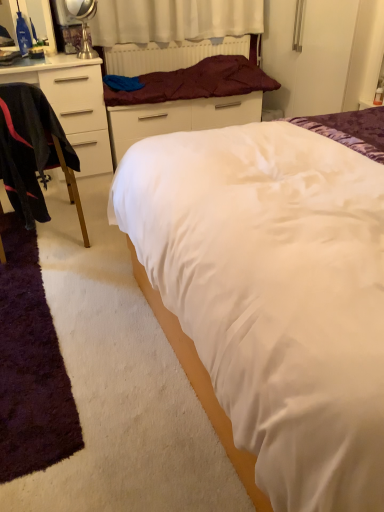
Describe the element at coordinates (188, 91) in the screenshot. I see `white glossy bed frame at upper center` at that location.

This screenshot has height=512, width=384. Describe the element at coordinates (260, 311) in the screenshot. I see `white satin bed at center` at that location.

In order to face white matte cabinet at left, should I rotate leftwards or rightwards?

Turn left by 18.884 degrees to look at white matte cabinet at left.

Where is `maroon fabric radiator at upper center`? Image resolution: width=384 pixels, height=512 pixels. maroon fabric radiator at upper center is located at coordinates (170, 55).

Image resolution: width=384 pixels, height=512 pixels. Describe the element at coordinates (30, 365) in the screenshot. I see `purple shaggy rug at lower left` at that location.

At what (x,y) coordinates should I click in order to perform the action: click on white glossy bed frame at upper center. Please return your answer as a coordinate pair (x, y). Looking at the image, I should click on [188, 91].

Is white glossy bed frame at upper center outside of maroon fabric radiator at upper center?

white glossy bed frame at upper center is positioned outside maroon fabric radiator at upper center.

Where is `radiator above the white glossy bed frame at upper center (from the image's perspective)`? This screenshot has width=384, height=512. radiator above the white glossy bed frame at upper center (from the image's perspective) is located at coordinates (170, 55).

Based on their positions, is white glossy bed frame at upper center located to the left or right of maroon fabric radiator at upper center?

Based on their positions, white glossy bed frame at upper center is located to the left of maroon fabric radiator at upper center.

How many degrees apart are the facing directions of white glossy bed frame at upper center and maroon fabric radiator at upper center?

0.422 degrees separate the facing orientations of white glossy bed frame at upper center and maroon fabric radiator at upper center.

Relative to white glossy bed frame at upper center, is white matte cabinet at left in front or behind?

Clearly, white matte cabinet at left is in front of white glossy bed frame at upper center.

Is white glossy bed frame at upper center completely or partially inside white matte cabinet at left?

No, white glossy bed frame at upper center is located outside of white matte cabinet at left.

Does white matte cabinet at left have a smaller size compared to white glossy bed frame at upper center?

No, white matte cabinet at left is not smaller than white glossy bed frame at upper center.

Is white matte cabinet at left at the right side of white glossy bed frame at upper center?

No.

Is maroon fabric radiator at upper center far away from burgundy fabric blanket at upper center?

maroon fabric radiator at upper center is near burgundy fabric blanket at upper center, not far away.

Is maroon fabric radiator at upper center behind burgundy fabric blanket at upper center?

Yes, maroon fabric radiator at upper center is behind burgundy fabric blanket at upper center.

Considering the relative sizes of maroon fabric radiator at upper center and burgundy fabric blanket at upper center in the image provided, is maroon fabric radiator at upper center bigger than burgundy fabric blanket at upper center?

No, maroon fabric radiator at upper center is not bigger than burgundy fabric blanket at upper center.

From the image's perspective, is purple shaggy rug at lower left beneath maroon fabric radiator at upper center?

Yes, from the image's perspective, purple shaggy rug at lower left is below maroon fabric radiator at upper center.

Is purple shaggy rug at lower left taller than maroon fabric radiator at upper center?

Incorrect, the height of purple shaggy rug at lower left is not larger of that of maroon fabric radiator at upper center.

Considering the points (138, 112) and (26, 74), which point is behind, point (138, 112) or point (26, 74)?

The point (138, 112) is farther.

Is white glossy bed frame at upper center not close to white matte cabinet at left?

No.

Does white glossy bed frame at upper center turn towards white matte cabinet at left?

No, white glossy bed frame at upper center is not aimed at white matte cabinet at left.

From the image's perspective, is white glossy bed frame at upper center located above white matte cabinet at left?

Yes, from the image's perspective, white glossy bed frame at upper center is above white matte cabinet at left.

Does point (181, 82) come in front of point (122, 65)?

Yes, it is in front of point (122, 65).

You are a GUI agent. You are given a task and a screenshot of the screen. Output one action in this format:
    pyautogui.click(x=<x>, y=<y>)
    Task: Click on the blanket on the right of maroon fabric radiator at upper center
    
    Given the screenshot: What is the action you would take?
    tap(196, 82)

Based on the photo, based on their positions, is burgundy fabric blanket at upper center located to the left or right of maroon fabric radiator at upper center?

Clearly, burgundy fabric blanket at upper center is on the right of maroon fabric radiator at upper center in the image.

From the image's perspective, between black fabric chair at left and burgundy fabric blanket at upper center, who is located below?

From the image's view, black fabric chair at left is below.

Which object is positioned more to the left, black fabric chair at left or burgundy fabric blanket at upper center?

black fabric chair at left.

Does point (41, 159) appear closer or farther from the camera than point (253, 77)?

Point (41, 159) is positioned closer to the camera compared to point (253, 77).

I want to click on bed frame in front of the maroon fabric radiator at upper center, so click(x=188, y=91).

Identify the location of cabinetry above the white glossy bed frame at upper center (from a real-world perspective). click(x=73, y=105).

Consider the image. Based on their spatial positions, is burgundy fabric blanket at upper center or white satin bed at center further from black fabric chair at left?

burgundy fabric blanket at upper center is positioned further to the anchor black fabric chair at left.

When comparing their distances from white satin bed at center, does purple shaggy rug at lower left or maroon fabric radiator at upper center seem closer?

Among the two, purple shaggy rug at lower left is located nearer to white satin bed at center.

From the picture: When comparing their distances from black fabric chair at left, does maroon fabric radiator at upper center or white satin bed at center seem further?

maroon fabric radiator at upper center is positioned further to the anchor black fabric chair at left.

Based on their spatial positions, is white satin bed at center or white glossy bed frame at upper center further from white matte cabinet at left?

white satin bed at center is further to white matte cabinet at left.

When comparing their distances from black fabric chair at left, does white satin bed at center or burgundy fabric blanket at upper center seem closer?

white satin bed at center is positioned closer to the anchor black fabric chair at left.

Looking at the image, which one is located further to white glossy bed frame at upper center, maroon fabric radiator at upper center or burgundy fabric blanket at upper center?

maroon fabric radiator at upper center lies further to white glossy bed frame at upper center than the other object.

Estimate the real-world distances between objects in this image. Which object is closer to white satin bed at center, purple shaggy rug at lower left or white matte cabinet at left?

purple shaggy rug at lower left.

When comparing their distances from purple shaggy rug at lower left, does white satin bed at center or white glossy bed frame at upper center seem closer?

Based on the image, white satin bed at center appears to be nearer to purple shaggy rug at lower left.

You are a GUI agent. You are given a task and a screenshot of the screen. Output one action in this format:
    pyautogui.click(x=<x>, y=<y>)
    Task: Click on the cabinetry positioned between purple shaggy rug at lower left and white glossy bed frame at upper center from near to far
    This screenshot has width=384, height=512.
    Given the screenshot: What is the action you would take?
    pyautogui.click(x=73, y=105)

At what (x,y) coordinates should I click in order to perform the action: click on mat located between white satin bed at center and burgundy fabric blanket at upper center in the depth direction. Please return your answer as a coordinate pair (x, y). This screenshot has width=384, height=512. Looking at the image, I should click on (30, 365).

I want to click on cabinetry between white satin bed at center and white glossy bed frame at upper center in the front-back direction, so click(x=73, y=105).

Locate an element on the screen. The height and width of the screenshot is (512, 384). cabinetry between maroon fabric radiator at upper center and purple shaggy rug at lower left from top to bottom is located at coordinates (73, 105).